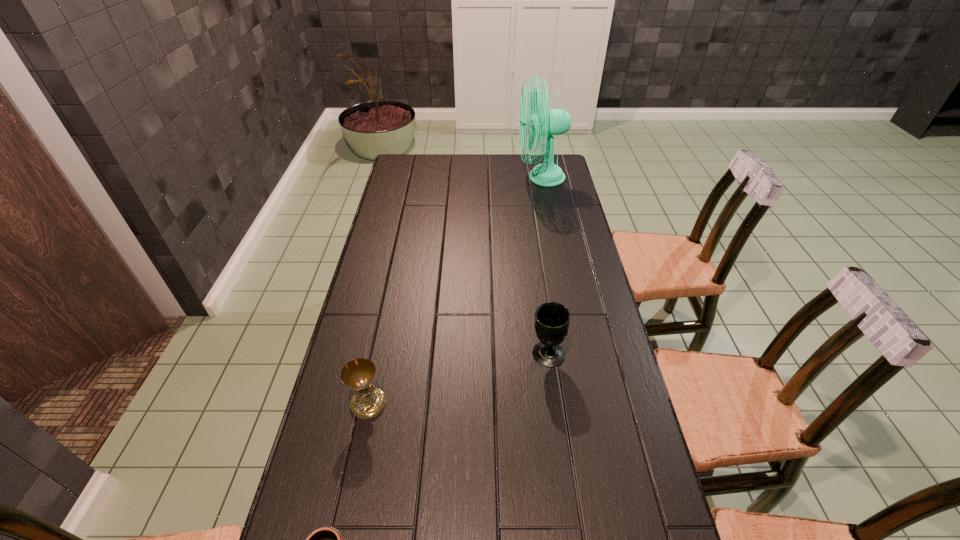
The image size is (960, 540). Find the location of `vacant space that satisfies the following two spatial constraints: 1. in front of the fan to blow air; 2. on the front side of the taller chalice`. vacant space that satisfies the following two spatial constraints: 1. in front of the fan to blow air; 2. on the front side of the taller chalice is located at coordinates (576, 354).